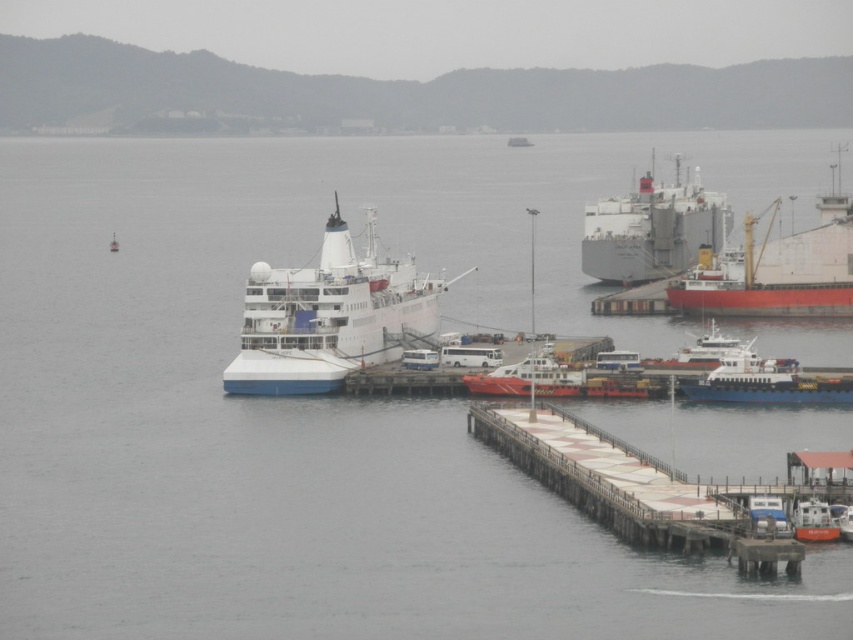
Does point (671, 189) come closer to viewer compared to point (469, 374)?

No.

Can you confirm if white matte cargo ship at center right is bigger than orange rubber boat at center?

Yes.

Where is `white matte cargo ship at center right`? Image resolution: width=853 pixels, height=640 pixels. white matte cargo ship at center right is located at coordinates (653, 230).

At what (x,y) coordinates should I click in order to perform the action: click on white matte cargo ship at center right. Please return your answer as a coordinate pair (x, y). This screenshot has height=640, width=853. Looking at the image, I should click on (653, 230).

The image size is (853, 640). I want to click on brown wooden dock at lower right, so click(x=625, y=486).

Who is more forward, (689,525) or (782,376)?

Positioned in front is point (689,525).

Where is `brown wooden dock at lower right`? This screenshot has width=853, height=640. brown wooden dock at lower right is located at coordinates (625, 486).

Does white matte cargo ship at center right have a larger size compared to white glossy boat at center?

Correct, white matte cargo ship at center right is larger in size than white glossy boat at center.

Who is more distant from viewer, (648, 188) or (846, 508)?

Point (648, 188)

This screenshot has width=853, height=640. In order to click on white matte cargo ship at center right in this screenshot , I will do `click(653, 230)`.